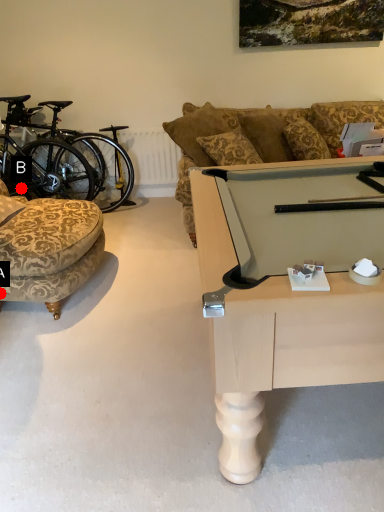
Question: Two points are circled on the image, labeled by A and B beside each circle. Which point is closer to the camera?

Choices:
 (A) A is closer
 (B) B is closer

Answer: (A)